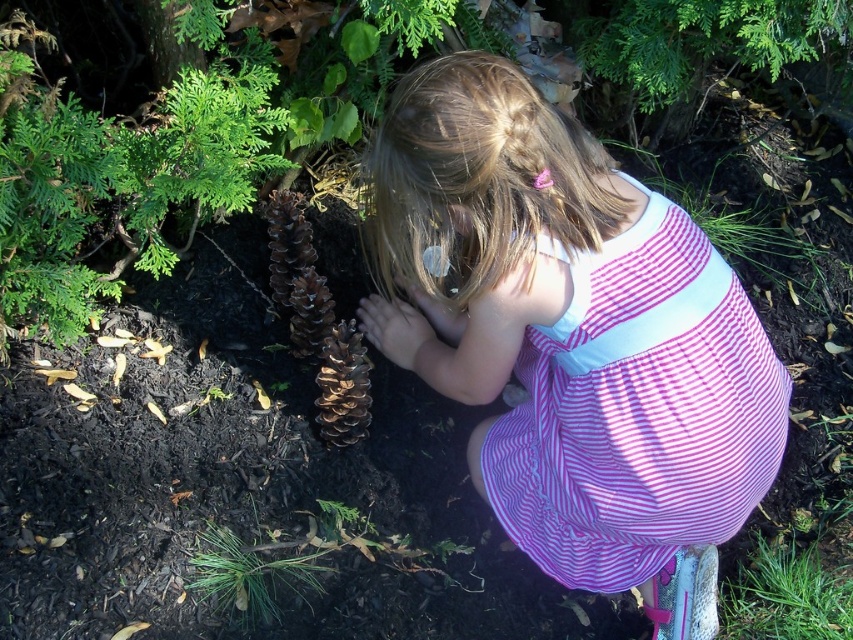
Does pink striped dress at center have a greater height compared to brown matte pine cone at center?

Correct, pink striped dress at center is much taller as brown matte pine cone at center.

Can you confirm if pink striped dress at center is positioned to the left of brown matte pine cone at center?

No, pink striped dress at center is not to the left of brown matte pine cone at center.

Is point (433, 333) closer to viewer compared to point (338, 412)?

No, (433, 333) is behind (338, 412).

The image size is (853, 640). I want to click on pink striped dress at center, so click(x=573, y=337).

Can you confirm if green matte pinecone at lower center is positioned below brown matte pine cone at center?

Correct, green matte pinecone at lower center is located below brown matte pine cone at center.

Who is positioned more to the right, green matte pinecone at lower center or brown matte pine cone at center?

brown matte pine cone at center is more to the right.

Between point (260, 600) and point (343, 374), which one is positioned in front?

Point (260, 600) is more forward.

The width and height of the screenshot is (853, 640). Find the location of `green matte pinecone at lower center`. green matte pinecone at lower center is located at coordinates (250, 572).

Who is higher up, pink striped dress at center or green matte pinecone at lower center?

pink striped dress at center is higher up.

Measure the distance between pink striped dress at center and green matte pinecone at lower center.

23.33 inches

Who is more forward, (589, 301) or (263, 604)?

Positioned in front is point (589, 301).

Where is `pink striped dress at center`? The height and width of the screenshot is (640, 853). pink striped dress at center is located at coordinates (573, 337).